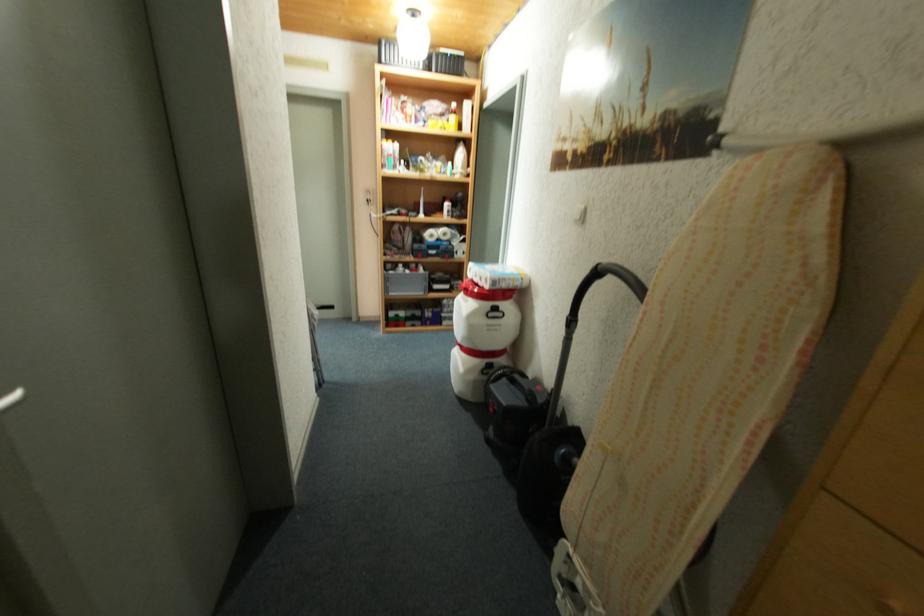
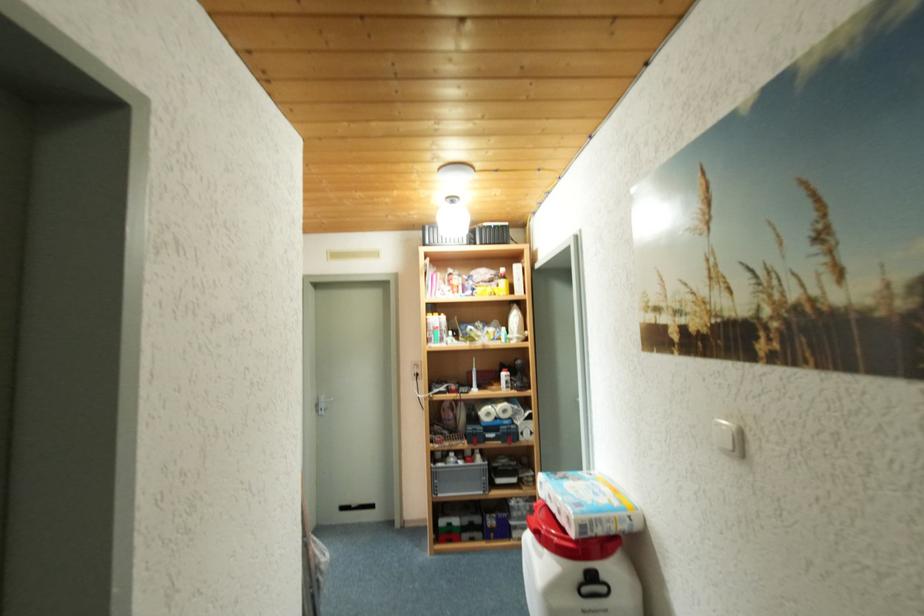
Question: The images are taken continuously from a first-person perspective. In which direction is your viewpoint rotating?

Choices:
 (A) Left
 (B) Right
 (C) Up
 (D) Down

Answer: (C)